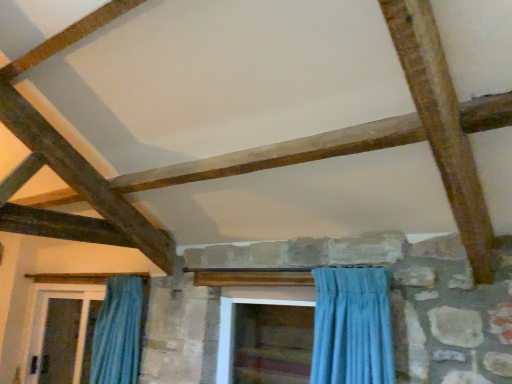
Question: Does clear glass screen door at lower left, marked as the second screen door in a right-to-left arrangement, have a greater width compared to wooden screen door at center, marked as the 2th screen door in a left-to-right arrangement?

Choices:
 (A) no
 (B) yes

Answer: (B)

Question: Is clear glass screen door at lower left, which ranks as the 1th screen door in left-to-right order, bigger than wooden screen door at center, the 2th screen door when ordered from back to front?

Choices:
 (A) yes
 (B) no

Answer: (A)

Question: From a real-world perspective, does clear glass screen door at lower left, arranged as the second screen door when viewed from the front, sit lower than wooden screen door at center, the 2th screen door when ordered from back to front?

Choices:
 (A) no
 (B) yes

Answer: (B)

Question: From the image's perspective, is clear glass screen door at lower left, arranged as the second screen door when viewed from the front, beneath wooden screen door at center, marked as the 2th screen door in a left-to-right arrangement?

Choices:
 (A) yes
 (B) no

Answer: (A)

Question: Is the depth of clear glass screen door at lower left, arranged as the second screen door when viewed from the front, less than that of wooden screen door at center, marked as the 2th screen door in a left-to-right arrangement?

Choices:
 (A) yes
 (B) no

Answer: (B)

Question: Considering the relative sizes of clear glass screen door at lower left, positioned as the first screen door in back-to-front order, and wooden screen door at center, marked as the 2th screen door in a left-to-right arrangement, in the image provided, is clear glass screen door at lower left, positioned as the first screen door in back-to-front order, thinner than wooden screen door at center, marked as the 2th screen door in a left-to-right arrangement,?

Choices:
 (A) no
 (B) yes

Answer: (A)

Question: Does blue fabric curtain at left have a greater width compared to clear glass screen door at lower left, arranged as the second screen door when viewed from the front?

Choices:
 (A) yes
 (B) no

Answer: (B)

Question: Is blue fabric curtain at left to the left of clear glass screen door at lower left, marked as the second screen door in a right-to-left arrangement, from the viewer's perspective?

Choices:
 (A) yes
 (B) no

Answer: (B)

Question: From a real-world perspective, is blue fabric curtain at left under clear glass screen door at lower left, positioned as the first screen door in back-to-front order?

Choices:
 (A) no
 (B) yes

Answer: (A)

Question: Does blue fabric curtain at left have a greater height compared to clear glass screen door at lower left, arranged as the second screen door when viewed from the front?

Choices:
 (A) no
 (B) yes

Answer: (A)

Question: Does blue fabric curtain at left have a lesser width compared to clear glass screen door at lower left, arranged as the second screen door when viewed from the front?

Choices:
 (A) no
 (B) yes

Answer: (B)

Question: Can you confirm if blue fabric curtain at left is positioned to the right of clear glass screen door at lower left, marked as the second screen door in a right-to-left arrangement?

Choices:
 (A) yes
 (B) no

Answer: (A)

Question: Can you confirm if blue fabric curtain at left is shorter than wooden screen door at center, marked as the first screen door in a front-to-back arrangement?

Choices:
 (A) yes
 (B) no

Answer: (B)